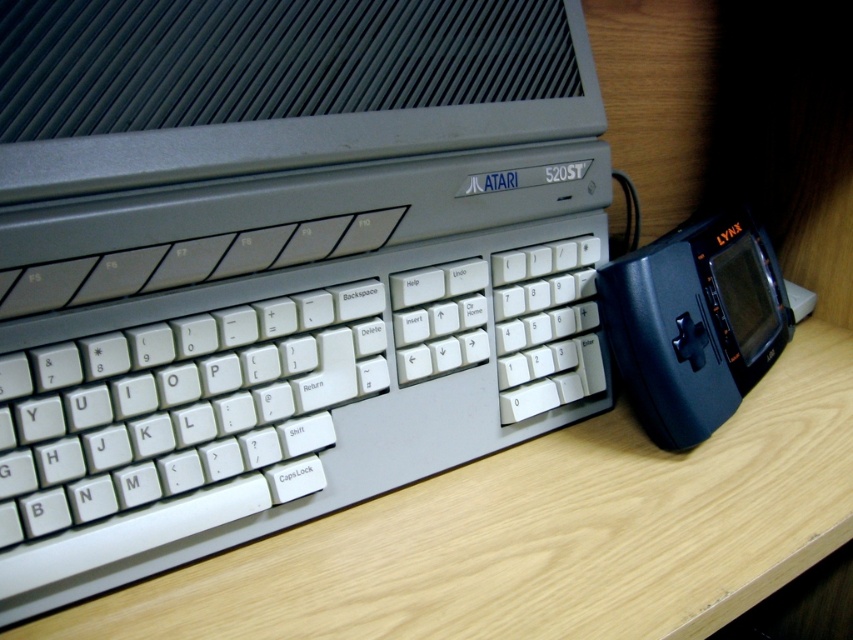
Question: Does matte gray computer at center come behind light wood table at center?

Choices:
 (A) yes
 (B) no

Answer: (B)

Question: Is the position of matte gray computer at center less distant than that of light wood table at center?

Choices:
 (A) no
 (B) yes

Answer: (B)

Question: Which of the following is the farthest from the observer?

Choices:
 (A) (55, 120)
 (B) (650, 496)

Answer: (B)

Question: Does matte gray computer at center have a smaller size compared to light wood table at center?

Choices:
 (A) no
 (B) yes

Answer: (B)